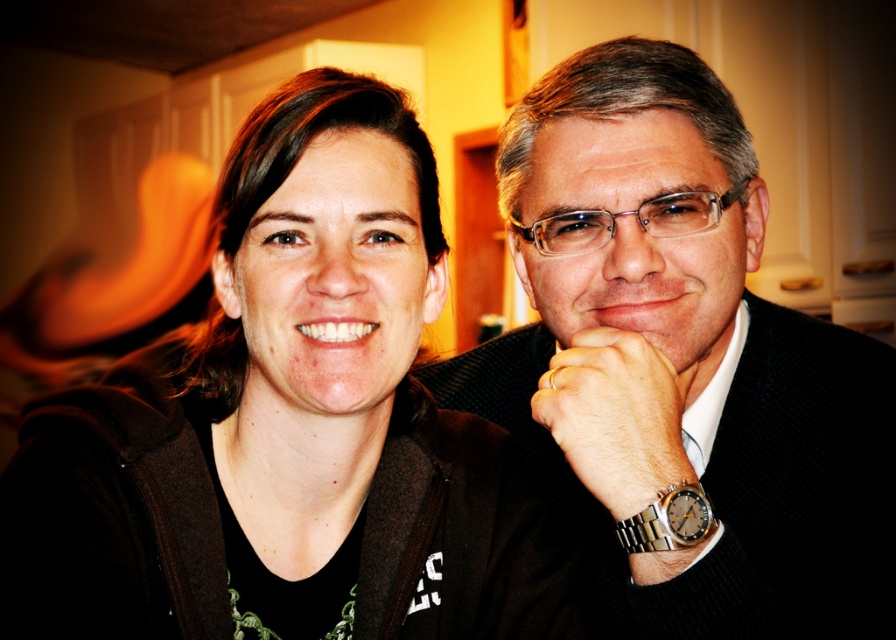
Can you confirm if matte black jacket at left is taller than black textured suit at center?

Incorrect, matte black jacket at left's height is not larger of black textured suit at center's.

Is matte black jacket at left below black textured suit at center?

Incorrect, matte black jacket at left is not positioned below black textured suit at center.

I want to click on matte black jacket at left, so click(x=289, y=426).

Who is positioned more to the right, matte black jacket at left or metallic gold ring at center?

metallic gold ring at center

Between matte black jacket at left and metallic gold ring at center, which one is positioned lower?

Positioned lower is metallic gold ring at center.

Is point (308, 470) less distant than point (665, 445)?

No, it is not.

The height and width of the screenshot is (640, 896). Find the location of `matte black jacket at left`. matte black jacket at left is located at coordinates (289, 426).

Does black textured suit at center have a lesser width compared to metallic gold ring at center?

No.

Which is behind, point (544, 452) or point (638, 388)?

The point (544, 452) is more distant.

Where is `black textured suit at center`? This screenshot has width=896, height=640. black textured suit at center is located at coordinates (681, 364).